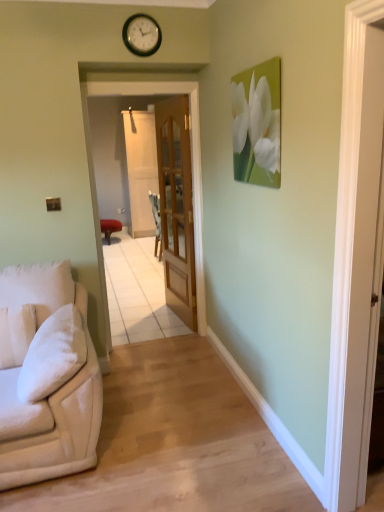
Where is `vacant space to the right of clear glass door at center, which is the second screen door from back to front`? vacant space to the right of clear glass door at center, which is the second screen door from back to front is located at coordinates (190, 347).